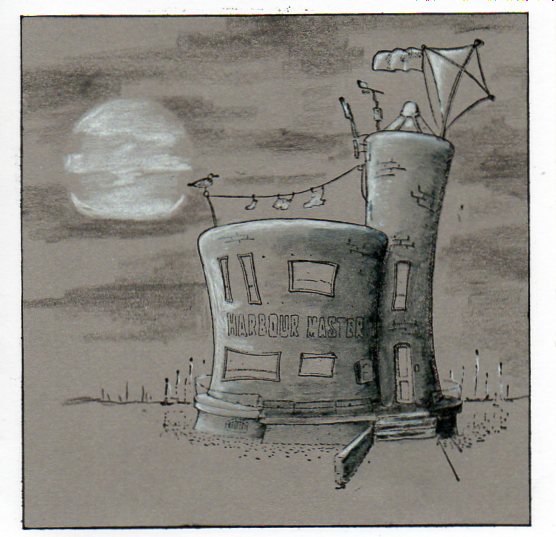
Locate an element on the screen. The height and width of the screenshot is (537, 556). art is located at coordinates (307, 307).